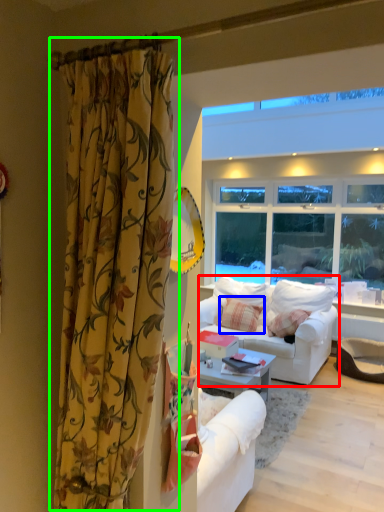
Question: Which is farther away from studio couch (highlighted by a red box)? pillow (highlighted by a blue box) or curtain (highlighted by a green box)?

Choices:
 (A) pillow
 (B) curtain

Answer: (B)